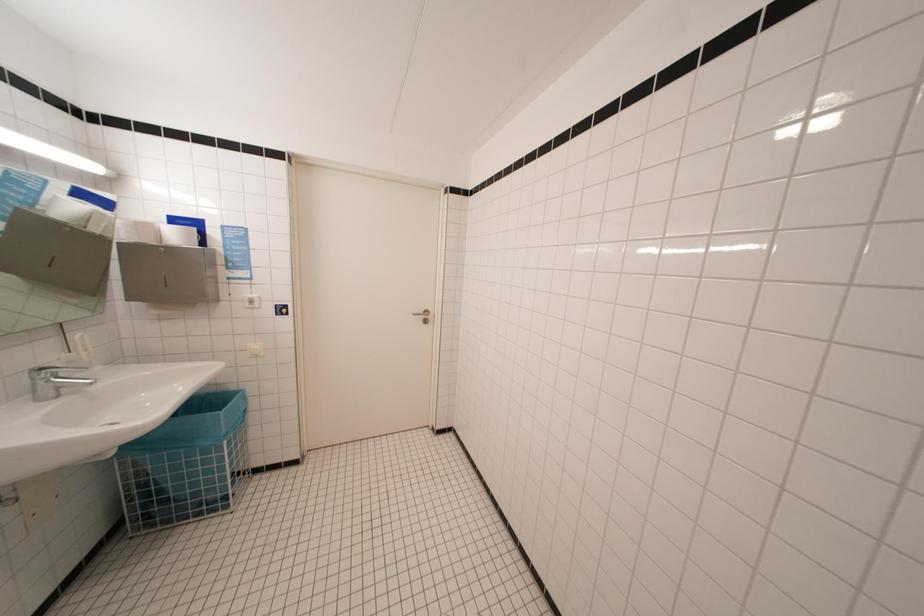
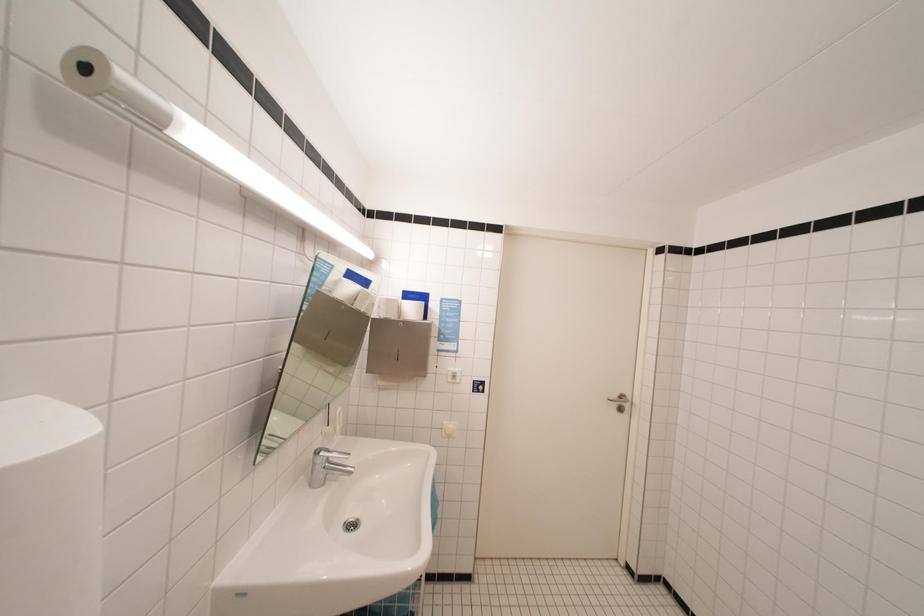
Question: How did the camera likely rotate?

Choices:
 (A) Left
 (B) Right
 (C) Up
 (D) Down

Answer: (A)